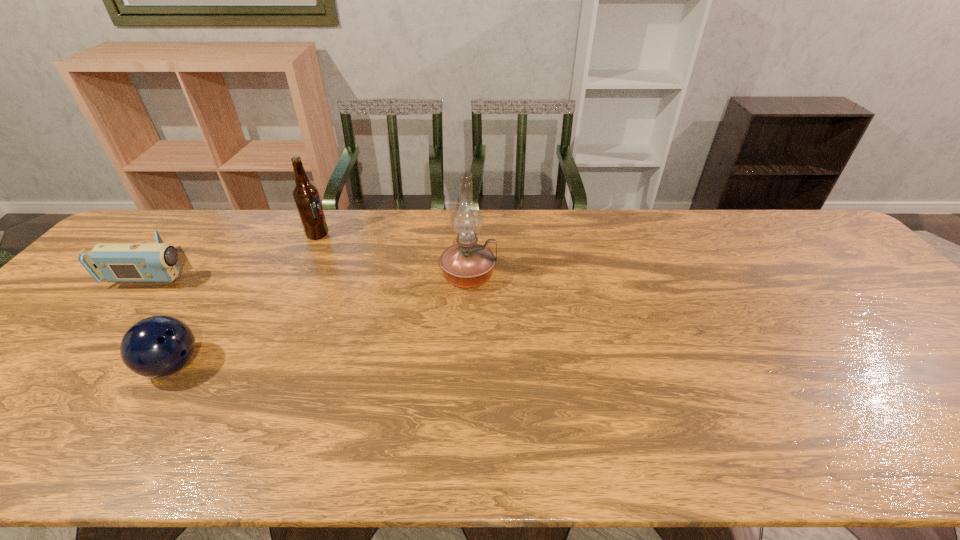
Where is `vacant region located on the side of the leftmost object with the flip-out screen`? This screenshot has height=540, width=960. vacant region located on the side of the leftmost object with the flip-out screen is located at coordinates (234, 269).

This screenshot has width=960, height=540. I want to click on beer bottle present at the far edge, so pos(306,196).

Locate an element on the screen. camcorder present at the far edge is located at coordinates (116, 262).

Where is `object located in the left edge section of the desktop`? This screenshot has height=540, width=960. object located in the left edge section of the desktop is located at coordinates [116, 262].

The image size is (960, 540). I want to click on object at the far left corner, so (x=116, y=262).

You are a GUI agent. You are given a task and a screenshot of the screen. Output one action in this format:
    pyautogui.click(x=<x>, y=<y>)
    Task: Click on the vacant space at the far edge of the desktop
    Image resolution: width=960 pixels, height=540 pixels.
    Given the screenshot: What is the action you would take?
    pyautogui.click(x=365, y=249)

You are a GUI agent. You are given a task and a screenshot of the screen. Output one action in this format:
    pyautogui.click(x=<x>, y=<y>)
    Task: Click on the vacant point at the near edge
    This screenshot has width=960, height=540.
    Given the screenshot: What is the action you would take?
    point(782,440)

Find the location of a particular element. This screenshot has height=540, width=960. blank area at the left edge is located at coordinates (104, 283).

The height and width of the screenshot is (540, 960). In order to click on free space at the right edge of the desktop in this screenshot , I will do `click(892, 336)`.

This screenshot has width=960, height=540. Identify the location of vacant area at the far right corner of the desktop. tap(829, 237).